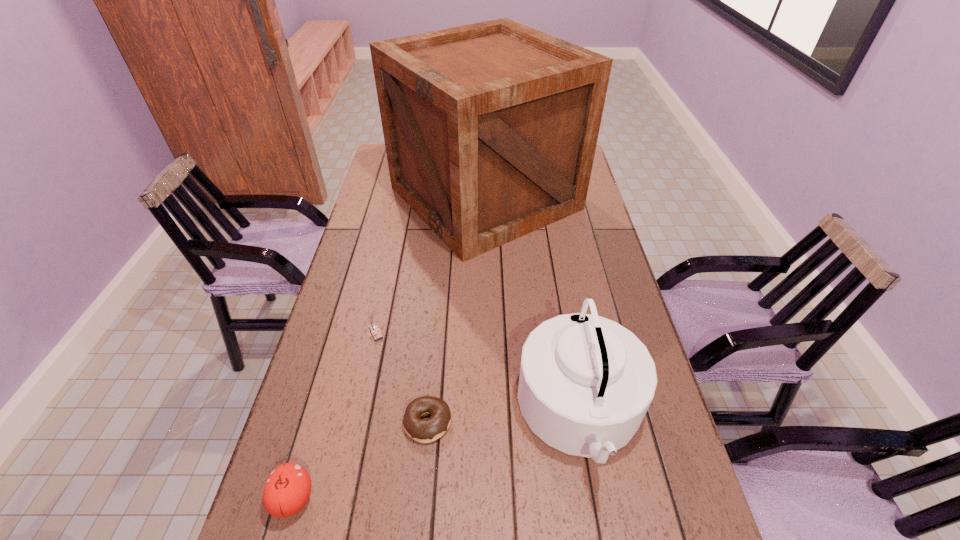
I want to click on object that is at the far right corner, so click(x=490, y=129).

Find the location of `free location at the left edge`. free location at the left edge is located at coordinates (361, 214).

Find the location of a particular element. Image resolution: width=960 pixels, height=540 pixels. vacant area at the right edge of the desktop is located at coordinates (604, 252).

You are a GUI agent. You are given a task and a screenshot of the screen. Output one action in this format:
    pyautogui.click(x=<x>, y=<y>)
    Task: Click on the blank region between the box and the fourth shortest object
    The height and width of the screenshot is (540, 960).
    Given the screenshot: What is the action you would take?
    pyautogui.click(x=533, y=305)

In order to click on vacant point located between the farthest object and the matchbox in this screenshot , I will do `click(430, 266)`.

Find the location of a particular element. Image resolution: width=960 pixels, height=540 pixels. empty space that is in between the fourth shortest object and the matchbox is located at coordinates (478, 373).

Find the location of a particular element. The height and width of the screenshot is (540, 960). vacant region between the box and the apple is located at coordinates (389, 348).

Identify the location of free space that is in between the farthest object and the shortest object. (456, 310).

Find the location of a particular element. The width and height of the screenshot is (960, 540). object that is the fourth closest to the kettle is located at coordinates (287, 490).

Identify the location of the fourth closest object relative to the farthest object. This screenshot has width=960, height=540. (287, 490).